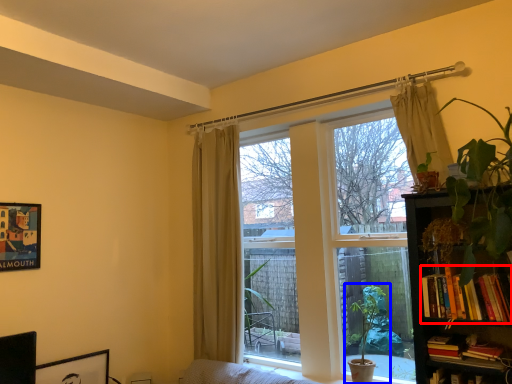
Question: Which object is further to the camera taking this photo, book (highlighted by a red box) or houseplant (highlighted by a blue box)?

Choices:
 (A) book
 (B) houseplant

Answer: (B)